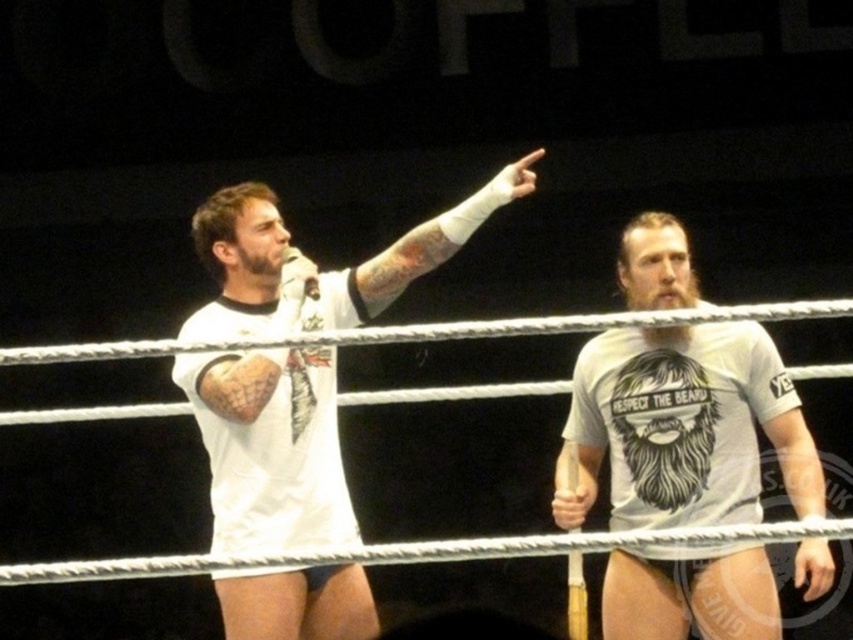
Who is taller, white matte t-shirt at center or white matte t-shirt at upper left?

With more height is white matte t-shirt at upper left.

Who is more forward, (817, 467) or (306, 480)?

Positioned in front is point (817, 467).

Where is `white matte t-shirt at center`? The width and height of the screenshot is (853, 640). white matte t-shirt at center is located at coordinates (683, 428).